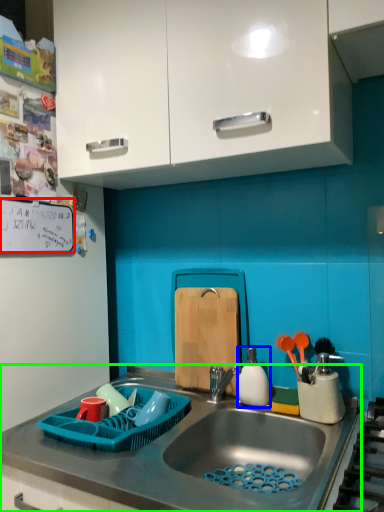
Question: Considering the real-world distances, which object is closest to bulletin board (highlighted by a red box)? appliance (highlighted by a blue box) or countertop (highlighted by a green box).

Choices:
 (A) appliance
 (B) countertop

Answer: (B)